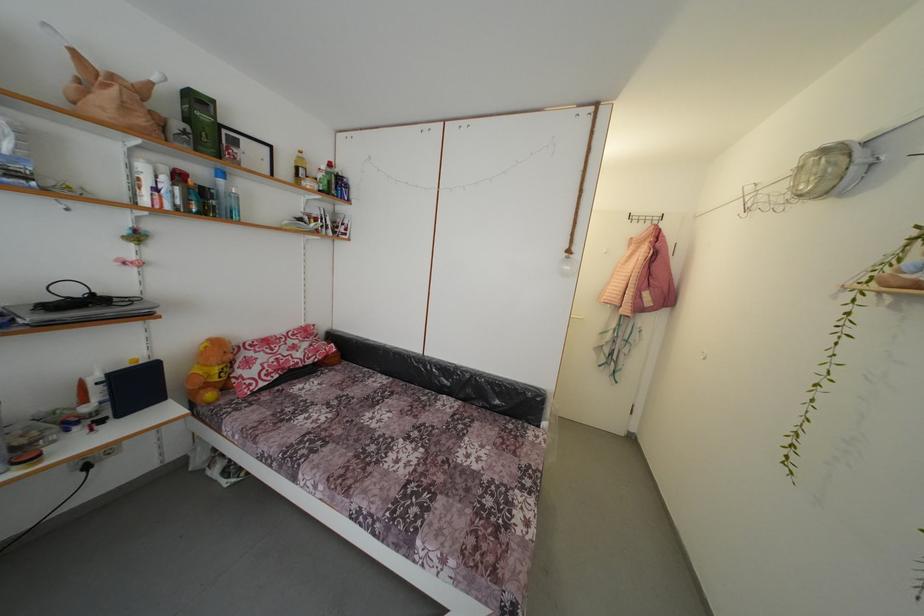
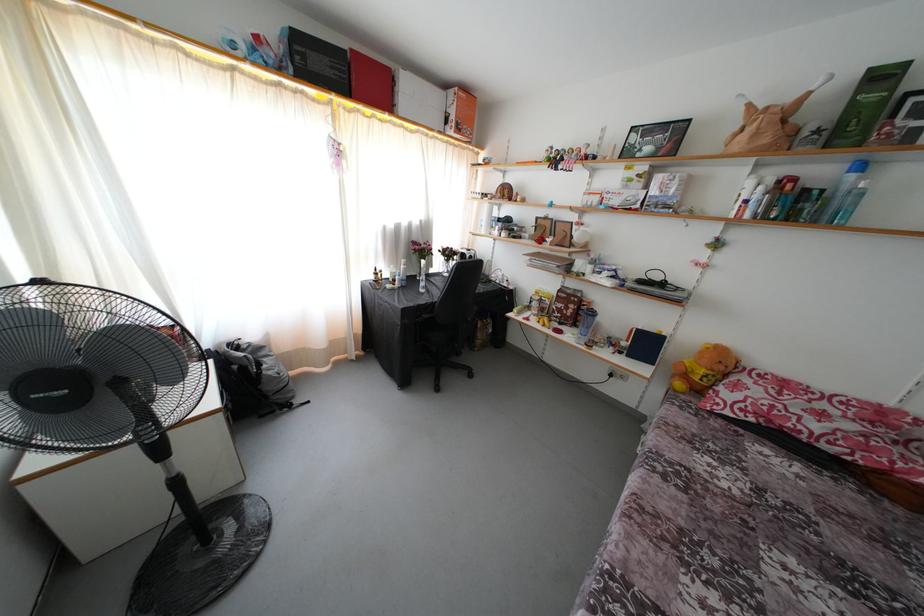
The point at [261,358] is marked in the first image. Where is the corresponding point in the second image?

(760, 389)